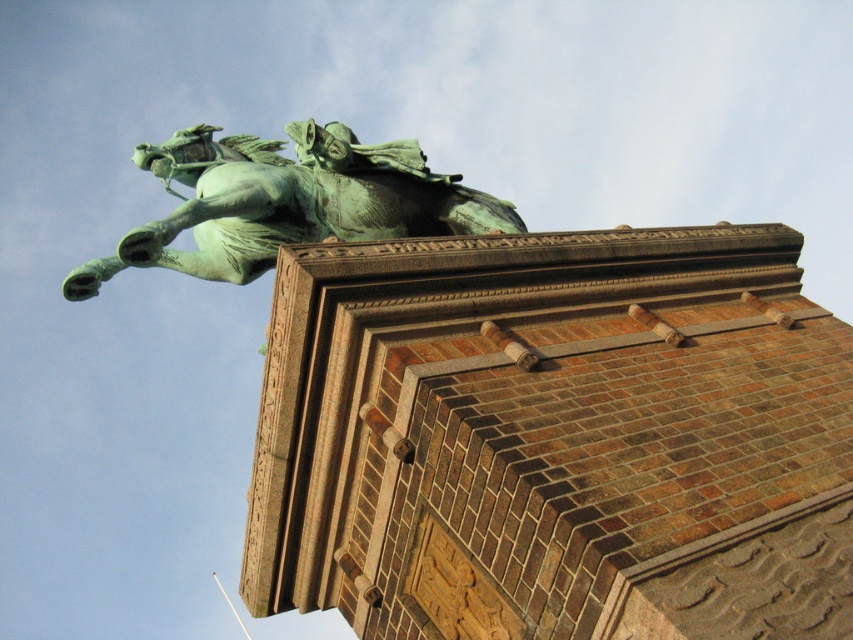
Is brown brick tower at upper center taller than green patina statue at upper center?

Yes, brown brick tower at upper center is taller than green patina statue at upper center.

Does point (764, 577) come farther from viewer compared to point (187, 224)?

No.

Locate an element on the screen. Image resolution: width=853 pixels, height=640 pixels. brown brick tower at upper center is located at coordinates (554, 438).